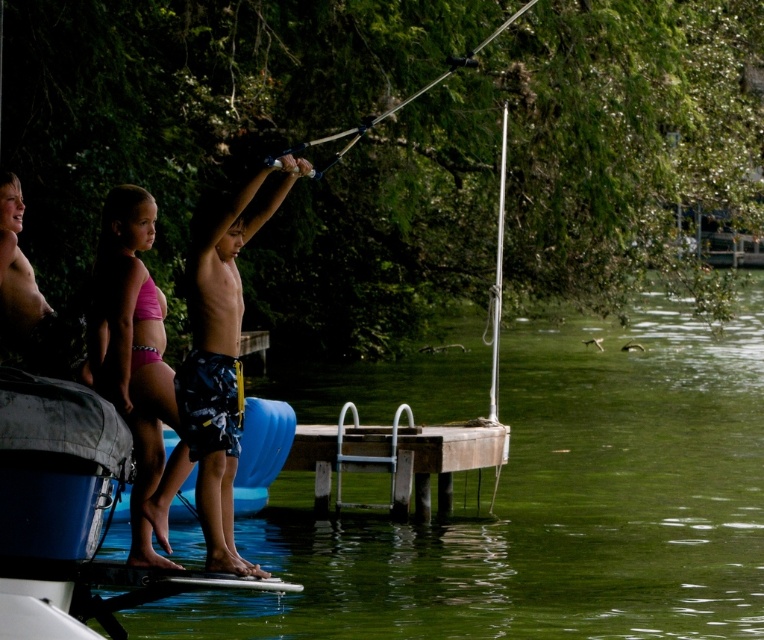
Looking at this image, you are a photographer trying to capture the entire scene of the brown wooden dock at center and the metallic silver fishing pole at upper center in one shot. Considering their heights, which object might appear closer to the camera due to its height?

The metallic silver fishing pole at upper center has a greater height than the brown wooden dock at center, so it might appear closer to the camera due to its height.

You are a photographer trying to capture the metallic silver fishing pole at upper center and the brown wooden dock at center in a single shot. Based on their positions, which object should you focus on first to ensure both are in frame?

The brown wooden dock at center is located below the metallic silver fishing pole at upper center, so you should focus on the metallic silver fishing pole at upper center first to ensure both are captured in the frame.